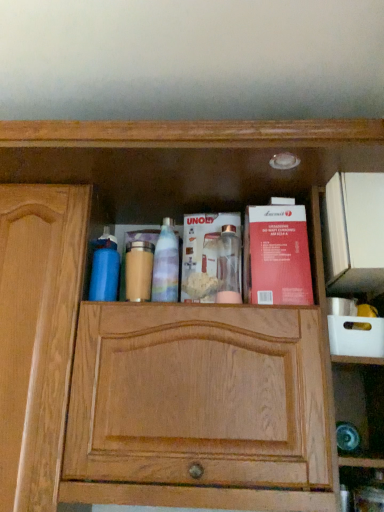
Question: In the image, is blue matte water bottle at left, arranged as the 1th cleaning product when viewed from the left, positioned in front of or behind metallic silver blender at center, the 2th book from the right?

Choices:
 (A) behind
 (B) front

Answer: (B)

Question: Is blue matte water bottle at left, arranged as the 1th cleaning product when viewed from the left, to the left or to the right of metallic silver blender at center, the 2th book from the right, in the image?

Choices:
 (A) left
 (B) right

Answer: (A)

Question: Which object is the farthest from the red matte book at center right, acting as the first book starting from the right?

Choices:
 (A) blue matte water bottle at left, arranged as the 1th cleaning product when viewed from the left
 (B) translucent plastic spray bottle at center, marked as the first cleaning product in a right-to-left arrangement
 (C) matte gold jar at center
 (D) metallic silver blender at center, the 2th book from the right

Answer: (A)

Question: Which of these objects is positioned farthest from the translucent plastic spray bottle at center, marked as the first cleaning product in a right-to-left arrangement?

Choices:
 (A) red matte book at center right, acting as the first book starting from the right
 (B) blue matte water bottle at left, arranged as the 1th cleaning product when viewed from the left
 (C) matte gold jar at center
 (D) metallic silver blender at center, which appears as the first book when viewed from the left

Answer: (A)